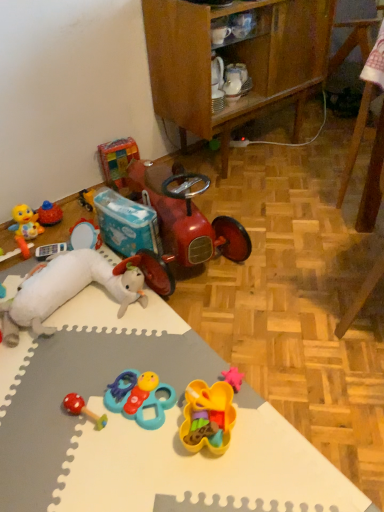
The width and height of the screenshot is (384, 512). I want to click on vacant space to the right of teal plastic toy at center, the third toy in the bottom-to-top sequence, so click(205, 376).